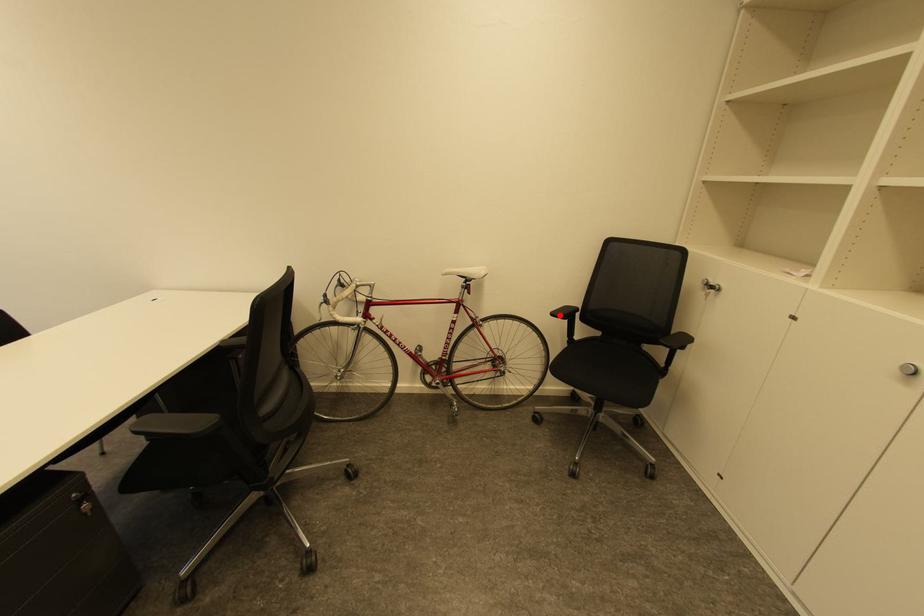
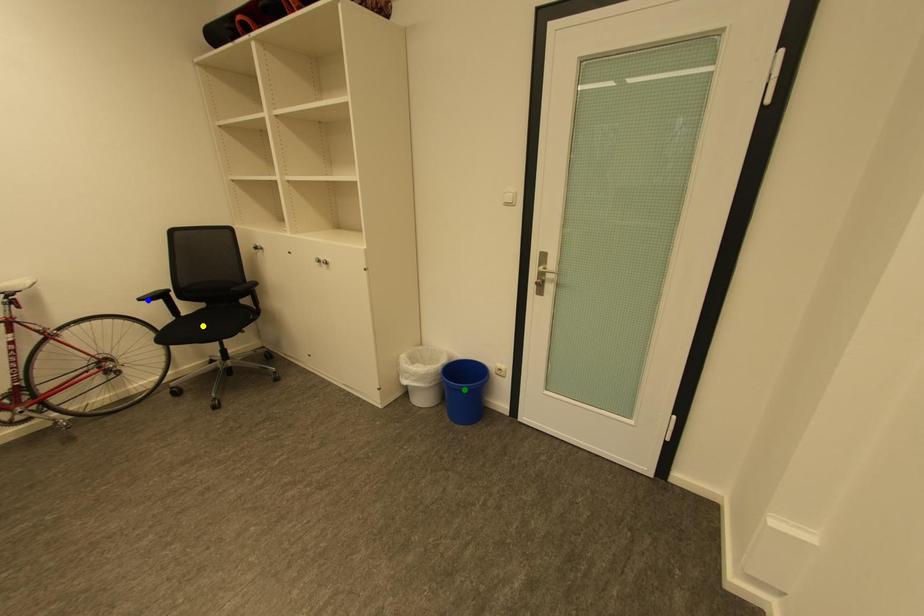
Question: I am providing you with two images of the same scene from different viewpoints. A red point is marked on the first image. You are given multiple points on the second image. Which mark in image 2 goes with the point in image 1?

Choices:
 (A) yellow point
 (B) blue point
 (C) green point

Answer: (B)